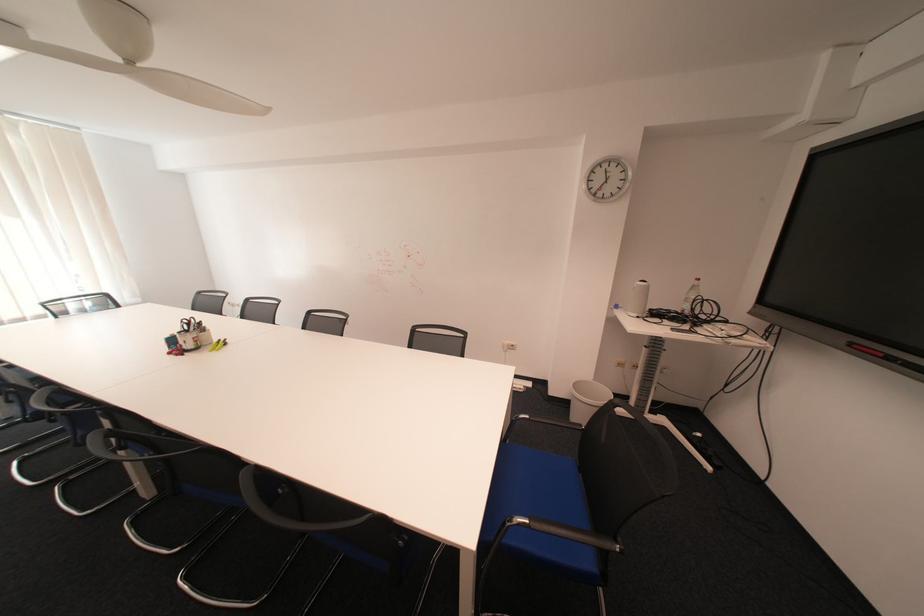
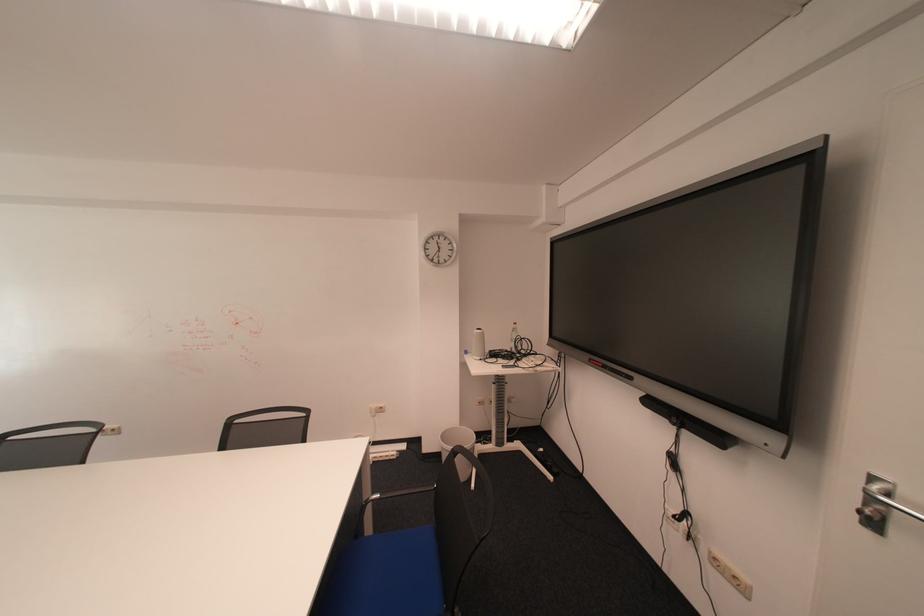
Where in the second image is the point corresponding to (626,310) from the first image?

(477, 355)